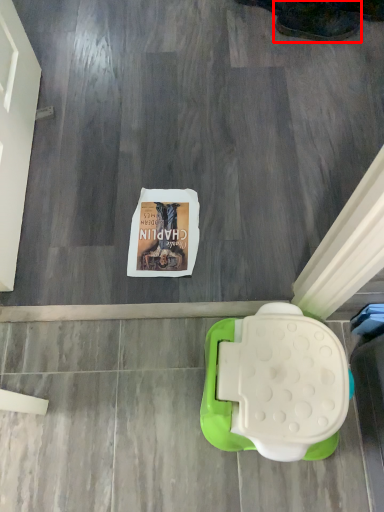
Question: From the image's perspective, considering the relative positions of footwear (annotated by the red box) and toilet in the image provided, where is footwear (annotated by the red box) located with respect to the staircase?

Choices:
 (A) below
 (B) above

Answer: (B)